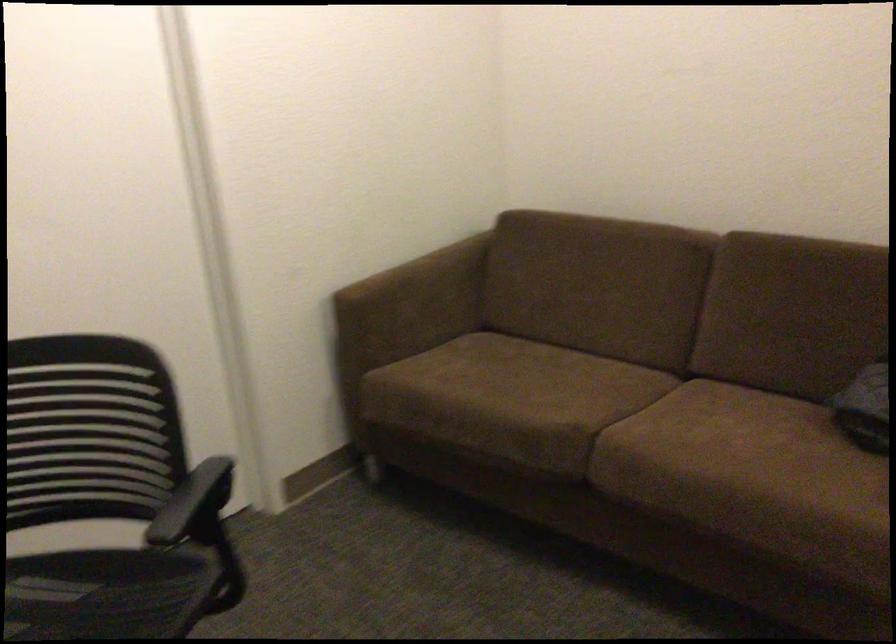
You are a GUI agent. You are given a task and a screenshot of the screen. Output one action in this format:
    pyautogui.click(x=<x>, y=<y>)
    Task: Click on the black chair armrest
    Image resolution: width=896 pixels, height=644 pixels.
    Given the screenshot: What is the action you would take?
    pyautogui.click(x=192, y=500)